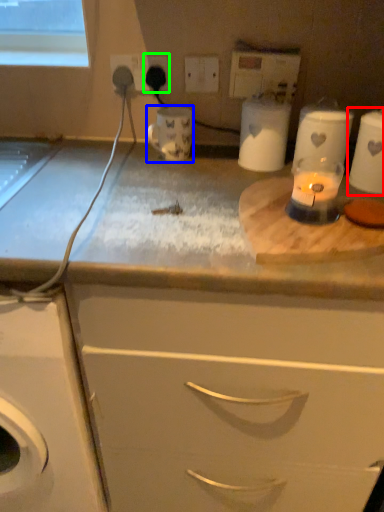
Question: Which object is the farthest from appliance (highlighted by a red box)? Choose among these: appliance (highlighted by a blue box) or electric outlet (highlighted by a green box).

Choices:
 (A) appliance
 (B) electric outlet

Answer: (B)